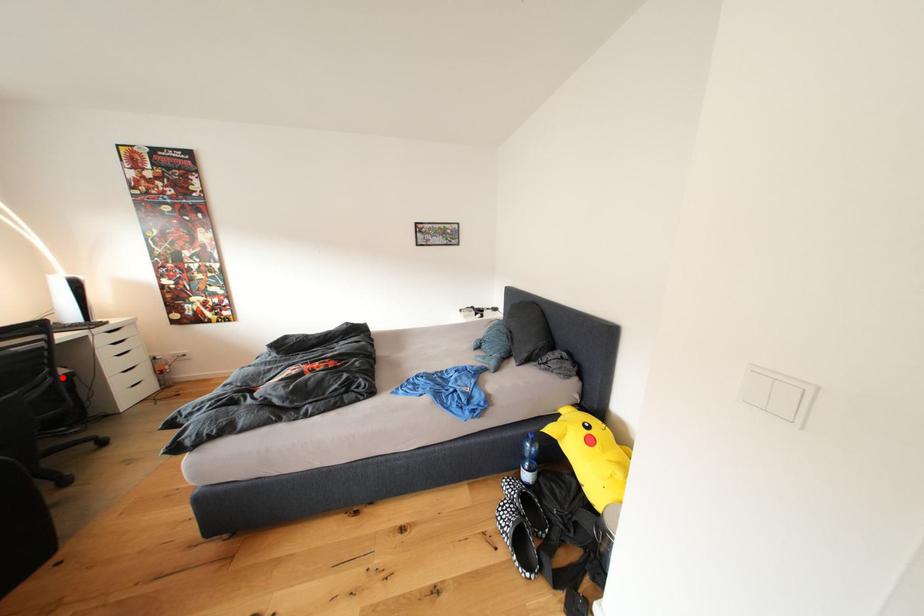
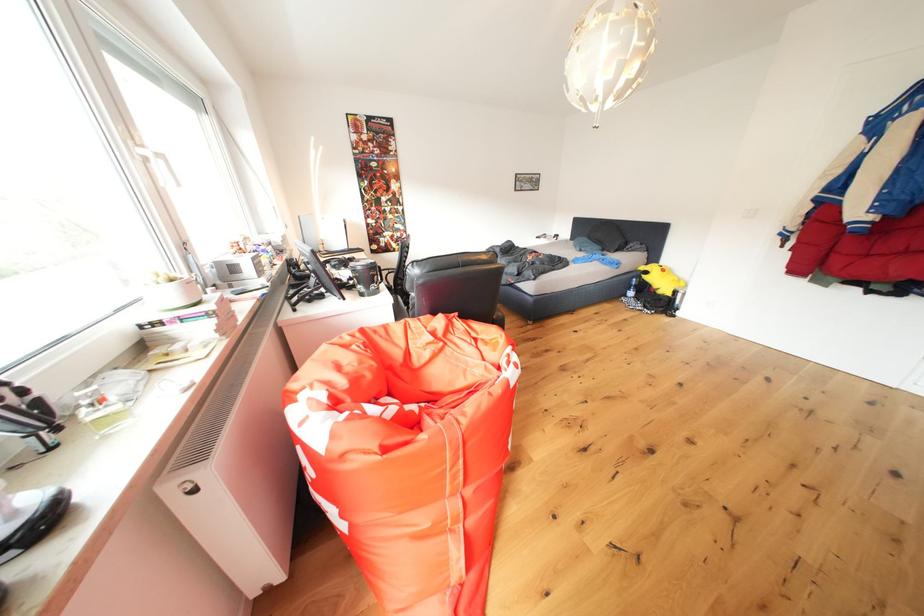
Question: I am providing you with two images of the same scene from different viewpoints. A red point is marked on the first image. Can you still see the location of the red point in image 2?

Choices:
 (A) Yes
 (B) No

Answer: (B)